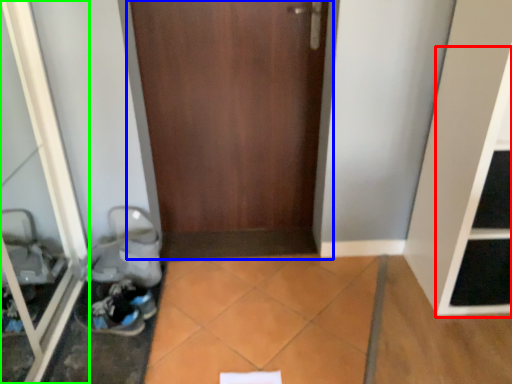
Question: Based on their relative distances, which object is nearer to shelf (highlighted by a red box)? Choose from door (highlighted by a blue box) and glass door (highlighted by a green box).

Choices:
 (A) door
 (B) glass door

Answer: (A)